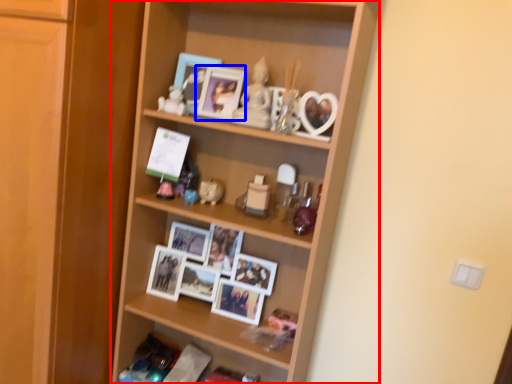
Question: Among these objects, which one is farthest to the camera, shelf (highlighted by a red box) or picture frame (highlighted by a blue box)?

Choices:
 (A) shelf
 (B) picture frame

Answer: (B)